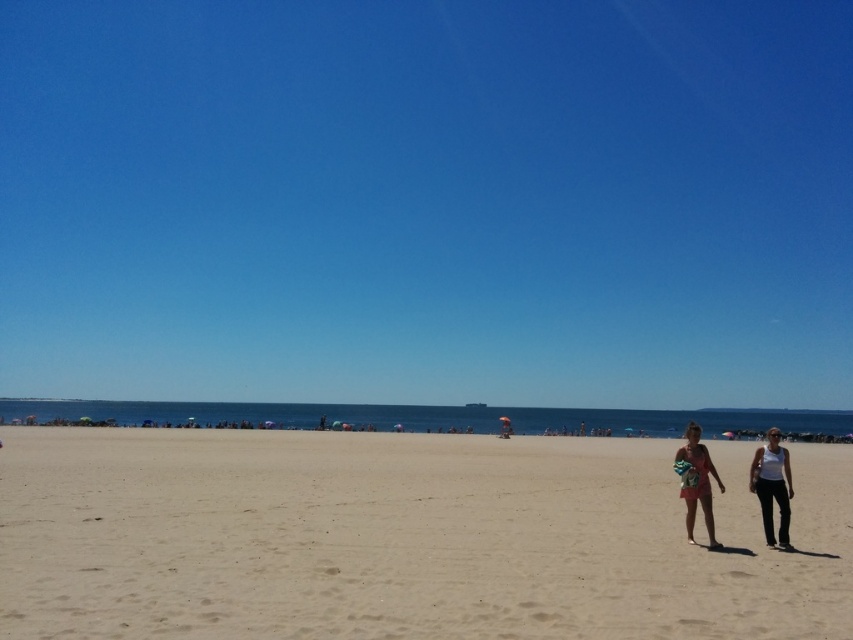
Can you confirm if beige sand at center is wider than white matte tank top at right?

Indeed, beige sand at center has a greater width compared to white matte tank top at right.

Does beige sand at center appear on the right side of white matte tank top at right?

In fact, beige sand at center is to the left of white matte tank top at right.

Is point (254, 445) closer to camera compared to point (782, 508)?

That is False.

Where is `beige sand at center`? beige sand at center is located at coordinates (403, 538).

Describe the element at coordinates (772, 486) in the screenshot. This screenshot has width=853, height=640. I see `white cotton tank top at lower right` at that location.

Is white cotton tank top at lower right to the left of beige cotton dress at lower right from the viewer's perspective?

In fact, white cotton tank top at lower right is to the right of beige cotton dress at lower right.

Is point (759, 449) positioned in front of point (701, 477)?

That is False.

Where is `white cotton tank top at lower right`? The width and height of the screenshot is (853, 640). white cotton tank top at lower right is located at coordinates (772, 486).

Looking at this image, is blue sky at upper center to the right of white matte tank top at right from the viewer's perspective?

No, blue sky at upper center is not to the right of white matte tank top at right.

Which of these two, blue sky at upper center or white matte tank top at right, stands shorter?

white matte tank top at right is shorter.

Where is `blue sky at upper center`? blue sky at upper center is located at coordinates (427, 200).